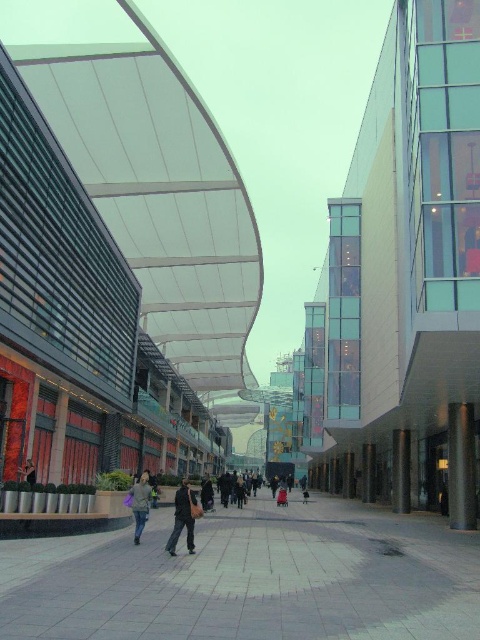
You are a fashion designer observing jackets in the scene. Which jacket, the light brown fabric jacket at center or the dark gray fabric jacket at lower left, is taller?

The light brown fabric jacket at center is taller than the dark gray fabric jacket at lower left.

You are a street performer planning to set up a small stage in the smooth concrete plaza at center and the red glossy pillar at center. Given that your stage requires a space larger than the pillar, which location would be suitable?

The smooth concrete plaza at center has a larger size compared to the red glossy pillar at center, so the stage should be set up in the smooth concrete plaza at center.